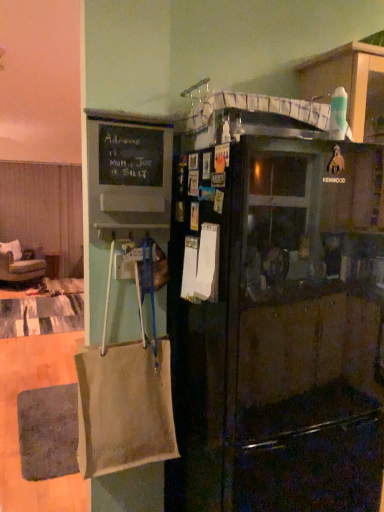
Question: Considering the relative sizes of green fabric chair at left and beige fabric curtain at left in the image provided, is green fabric chair at left wider than beige fabric curtain at left?

Choices:
 (A) no
 (B) yes

Answer: (B)

Question: Is green fabric chair at left in front of beige fabric curtain at left?

Choices:
 (A) yes
 (B) no

Answer: (A)

Question: Is green fabric chair at left to the right of beige fabric curtain at left from the viewer's perspective?

Choices:
 (A) no
 (B) yes

Answer: (B)

Question: Does green fabric chair at left have a larger size compared to beige fabric curtain at left?

Choices:
 (A) yes
 (B) no

Answer: (A)

Question: From the image's perspective, is green fabric chair at left beneath beige fabric curtain at left?

Choices:
 (A) no
 (B) yes

Answer: (B)

Question: Is beige fabric curtain at left at the back of green fabric chair at left?

Choices:
 (A) yes
 (B) no

Answer: (B)

Question: Is black matte refrigerator at center surrounding beige canvas bag at left?

Choices:
 (A) yes
 (B) no

Answer: (B)

Question: Considering the relative positions of black matte refrigerator at center and beige canvas bag at left in the image provided, is black matte refrigerator at center to the left of beige canvas bag at left from the viewer's perspective?

Choices:
 (A) yes
 (B) no

Answer: (B)

Question: From a real-world perspective, does black matte refrigerator at center sit lower than beige canvas bag at left?

Choices:
 (A) yes
 (B) no

Answer: (A)

Question: Is black matte refrigerator at center further to the viewer compared to beige canvas bag at left?

Choices:
 (A) no
 (B) yes

Answer: (A)

Question: Considering the relative sizes of black matte refrigerator at center and beige canvas bag at left in the image provided, is black matte refrigerator at center taller than beige canvas bag at left?

Choices:
 (A) yes
 (B) no

Answer: (A)

Question: Is black matte refrigerator at center facing towards beige canvas bag at left?

Choices:
 (A) yes
 (B) no

Answer: (B)

Question: Is green fabric chair at left touching black matte refrigerator at center?

Choices:
 (A) yes
 (B) no

Answer: (B)